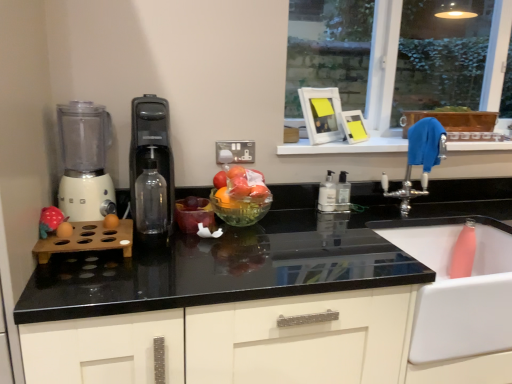
Question: Can you confirm if matte pink plush toy at left is shorter than translucent plastic bowl at center?

Choices:
 (A) no
 (B) yes

Answer: (B)

Question: Is matte pink plush toy at left facing towards translucent plastic bowl at center?

Choices:
 (A) yes
 (B) no

Answer: (B)

Question: Does matte pink plush toy at left touch translucent plastic bowl at center?

Choices:
 (A) yes
 (B) no

Answer: (B)

Question: Is matte pink plush toy at left positioned with its back to translucent plastic bowl at center?

Choices:
 (A) no
 (B) yes

Answer: (A)

Question: Can you confirm if matte pink plush toy at left is taller than translucent plastic bowl at center?

Choices:
 (A) no
 (B) yes

Answer: (A)

Question: From a real-world perspective, is black plastic water dispenser at center physically located above or below transparent glass bottle at center, arranged as the 3th bottle when viewed from the right?

Choices:
 (A) above
 (B) below

Answer: (A)

Question: Is black plastic water dispenser at center taller or shorter than transparent glass bottle at center, positioned as the 3th bottle in back-to-front order?

Choices:
 (A) tall
 (B) short

Answer: (A)

Question: Is black plastic water dispenser at center to the left or to the right of transparent glass bottle at center, which appears as the first bottle when viewed from the front, in the image?

Choices:
 (A) left
 (B) right

Answer: (A)

Question: Considering the positions of black plastic water dispenser at center and transparent glass bottle at center, positioned as the 3th bottle in back-to-front order, in the image, is black plastic water dispenser at center wider or thinner than transparent glass bottle at center, positioned as the 3th bottle in back-to-front order,?

Choices:
 (A) thin
 (B) wide

Answer: (B)

Question: From the image's perspective, is translucent plastic bowl at center located above or below matte pink plush toy at left?

Choices:
 (A) below
 (B) above

Answer: (B)

Question: From a real-world perspective, is translucent plastic bowl at center physically located above or below matte pink plush toy at left?

Choices:
 (A) below
 (B) above

Answer: (B)

Question: Considering the positions of translucent plastic bowl at center and matte pink plush toy at left in the image, is translucent plastic bowl at center taller or shorter than matte pink plush toy at left?

Choices:
 (A) tall
 (B) short

Answer: (A)

Question: Visually, is translucent plastic bowl at center positioned to the left or to the right of matte pink plush toy at left?

Choices:
 (A) right
 (B) left

Answer: (A)

Question: Considering their positions, is transparent glass bottle at center, marked as the 1th bottle in a left-to-right arrangement, located in front of or behind white matte blender at left?

Choices:
 (A) front
 (B) behind

Answer: (A)

Question: Is transparent glass bottle at center, positioned as the 3th bottle in back-to-front order, wider or thinner than white matte blender at left?

Choices:
 (A) thin
 (B) wide

Answer: (A)